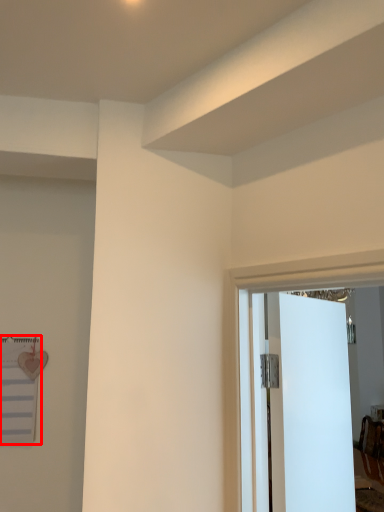
Question: From the image's perspective, where is bulletin board (annotated by the red box) located relative to door?

Choices:
 (A) below
 (B) above

Answer: (B)